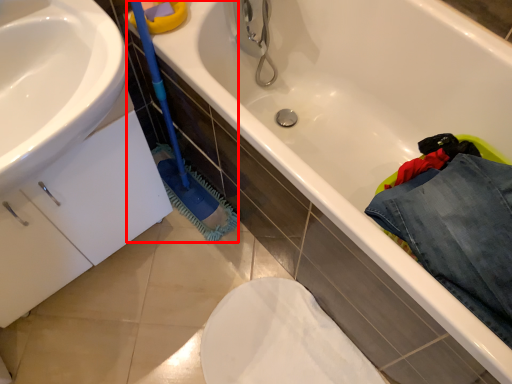
Question: From the image, what is the correct spatial relationship of brush (annotated by the red box) in relation to clothing?

Choices:
 (A) right
 (B) left

Answer: (B)